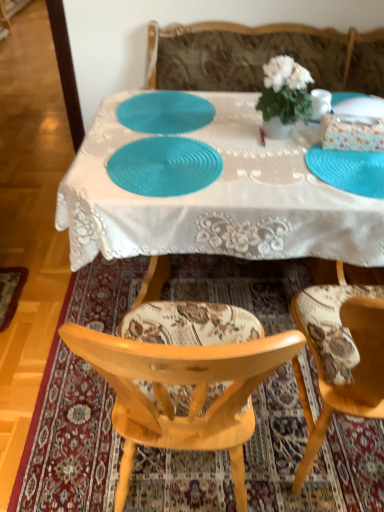
This screenshot has width=384, height=512. I want to click on free space below blue rubber placemat at lower right, the 3th plate from the left (from a real-world perspective), so click(353, 169).